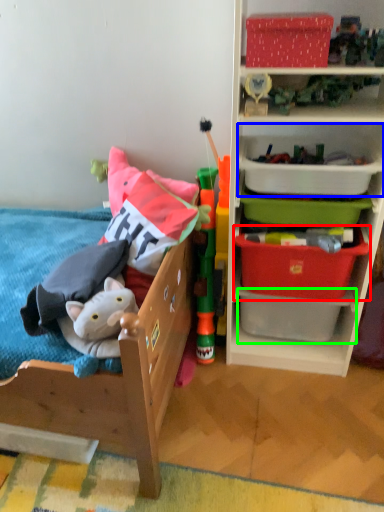
Question: Based on their relative distances, which object is nearer to storage box (highlighted by a red box)? Choose from storage box (highlighted by a blue box) and storage box (highlighted by a green box).

Choices:
 (A) storage box
 (B) storage box

Answer: (B)